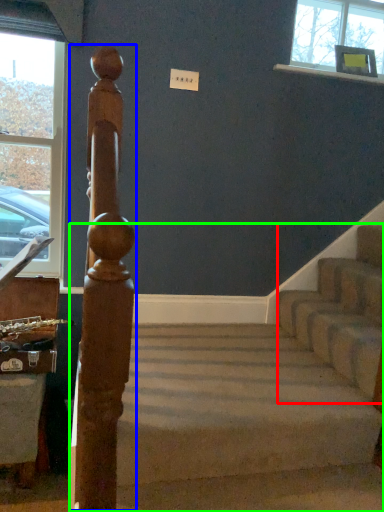
Question: Which object is positioned farthest from stairwell (highlighted by a red box)? Select from beam (highlighted by a blue box) and stairs (highlighted by a green box).

Choices:
 (A) beam
 (B) stairs

Answer: (A)